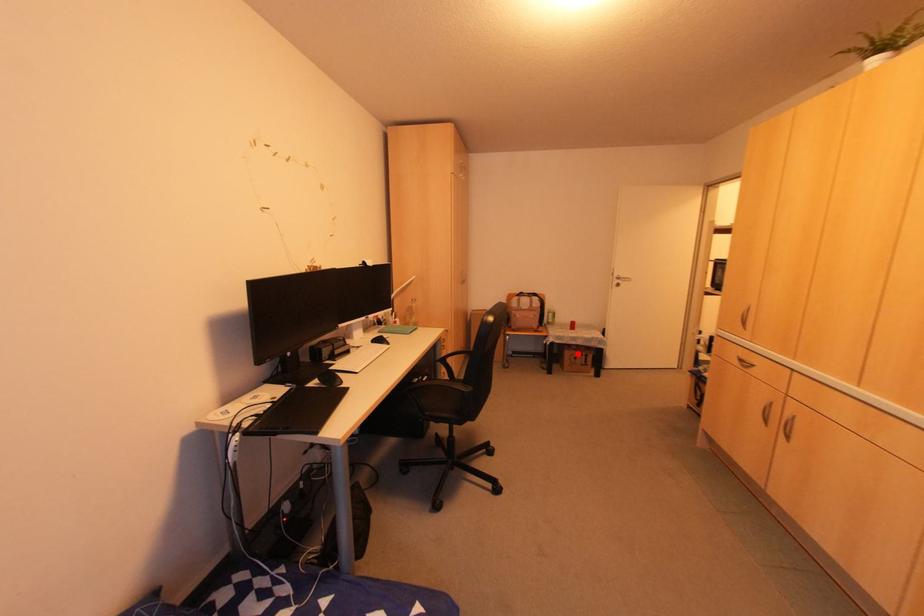
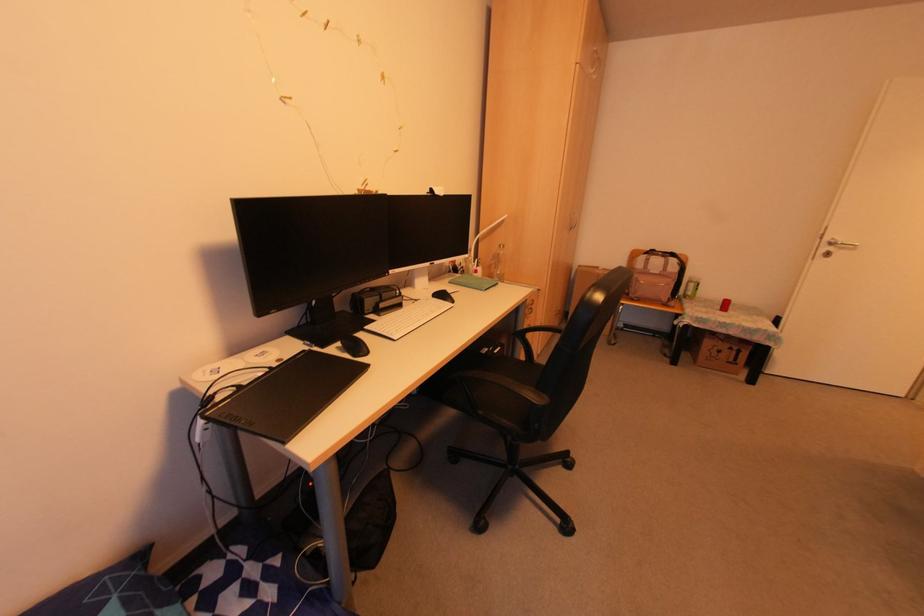
Question: A red point is marked in image1. In image2, is the corresponding 3D point closer to the camera or farther? Reply with the corresponding letter.

Choices:
 (A) The corresponding 3D point is closer.
 (B) The corresponding 3D point is farther.

Answer: (A)